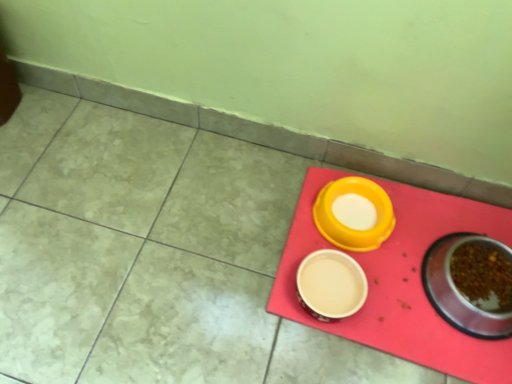
The width and height of the screenshot is (512, 384). In order to click on free space that is to the left of rubberized red tray at lower right in this screenshot , I will do `click(210, 251)`.